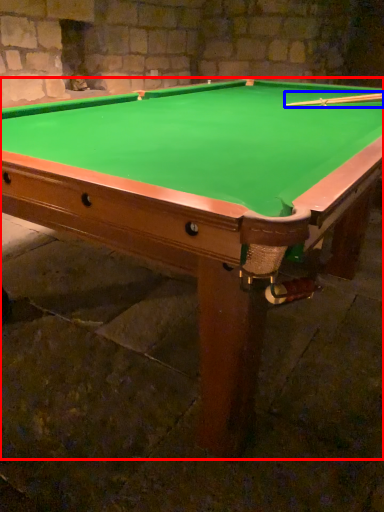
Question: Which object is closer to the camera taking this photo, billiard table (highlighted by a red box) or cue (highlighted by a blue box)?

Choices:
 (A) billiard table
 (B) cue

Answer: (A)